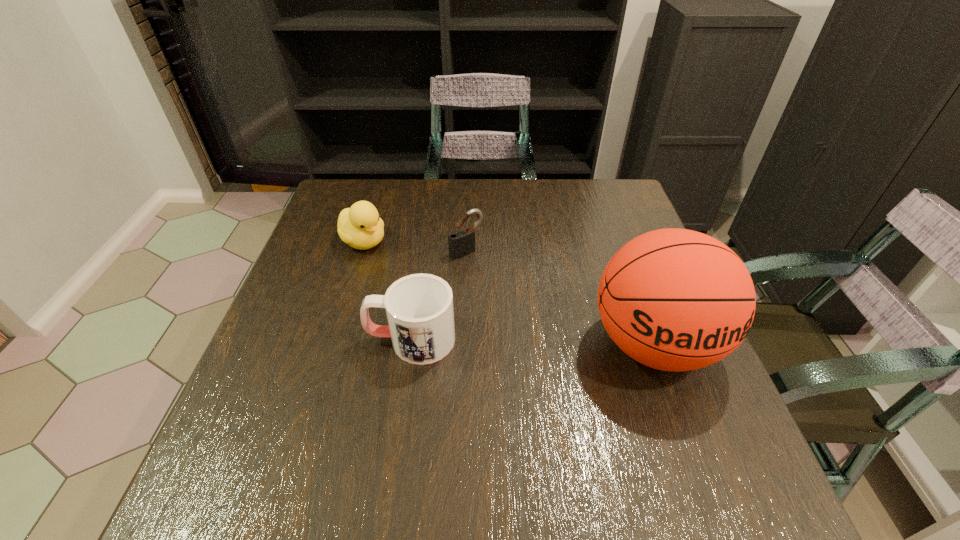
In the image, there is a desktop. Find the location of `vacant space at the far left corner`. vacant space at the far left corner is located at coordinates (338, 185).

At what (x,y) coordinates should I click in order to perform the action: click on blank area at the far right corner. Please return your answer as a coordinate pair (x, y). The height and width of the screenshot is (540, 960). Looking at the image, I should click on (621, 217).

Identify the location of free space at the near right corner. This screenshot has width=960, height=540. (637, 404).

At what (x,y) coordinates should I click in order to perform the action: click on empty space that is in between the mug and the tallest object. Please return your answer as a coordinate pair (x, y). The image size is (960, 540). Looking at the image, I should click on (533, 342).

Locate an element on the screen. The width and height of the screenshot is (960, 540). free point between the mug and the basketball is located at coordinates (533, 342).

Locate an element on the screen. vacant point located between the leftmost object and the basketball is located at coordinates (509, 293).

At what (x,y) coordinates should I click in order to perform the action: click on vacant area that lies between the padlock and the basketball. Please return your answer as a coordinate pair (x, y). The image size is (960, 540). Looking at the image, I should click on (560, 298).

Locate an element on the screen. Image resolution: width=960 pixels, height=540 pixels. vacant space that is in between the rightmost object and the leftmost object is located at coordinates (509, 293).

Where is `free space between the leftmost object and the padlock`? This screenshot has height=540, width=960. free space between the leftmost object and the padlock is located at coordinates (415, 246).

Locate which object ranks third in proximity to the duck. Please provide its 2D coordinates. Your answer should be formatted as a tuple, i.e. [(x, y)], where the tuple contains the x and y coordinates of a point satisfying the conditions above.

[(673, 299)]